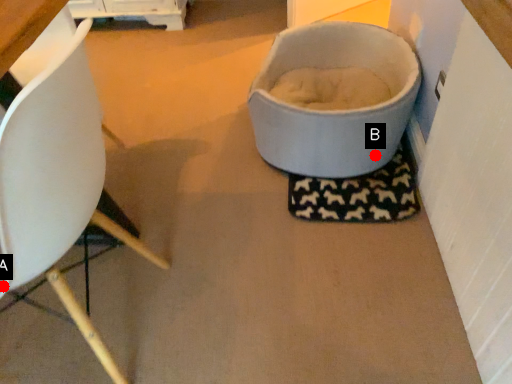
Question: Two points are circled on the image, labeled by A and B beside each circle. Which point appears farthest from the camera in this image?

Choices:
 (A) A is further
 (B) B is further

Answer: (B)